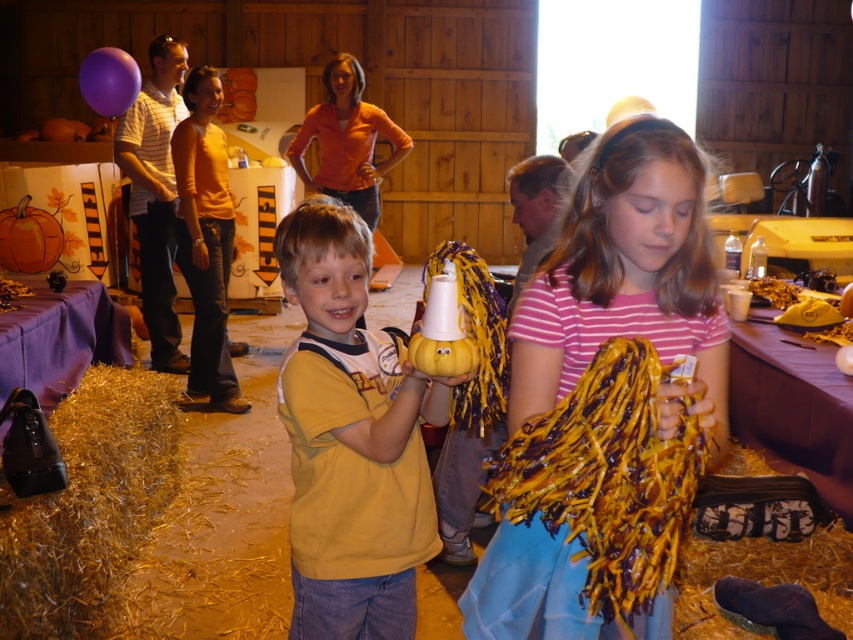
You are standing at the entrance of the barn and want to find the yellow matte pumpkin at center. According to the coordinates provided, in which direction should you walk to locate it?

The yellow matte pumpkin at center is located at coordinates point (351,440) which is towards the right side of the barn since the x coordinate is higher than 0.5. So you should walk towards the right side of the barn to locate it.

You are a parent trying to locate your child who is holding the yellow matte pumpkin at center. You see the gold shredded hay at lower left on the floor. Is the pumpkin above or below the hay?

The yellow matte pumpkin at center is above the gold shredded hay at lower left.

You are organizing a photo shoot in the barn and need to place a prop on the floor. The prop requires a clear space larger than the striped cotton shirt at center. Is there enough space near the gold shredded hay at lower left?

The gold shredded hay at lower left is larger in size than the striped cotton shirt at center, so there should be sufficient space near the gold shredded hay at lower left to place the prop requiring a clear space larger than the striped cotton shirt at center.